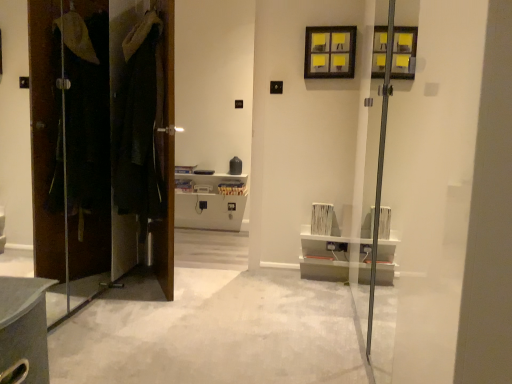
Question: Should I look upward or downward to see white carpet at center?

Choices:
 (A) down
 (B) up

Answer: (A)

Question: From a real-world perspective, is dark brown leather coat at left, which appears as the second door when viewed from the left, positioned over yellow paper at upper center based on gravity?

Choices:
 (A) yes
 (B) no

Answer: (B)

Question: Is there a large distance between dark brown leather coat at left, the first door in the right-to-left sequence, and yellow paper at upper center?

Choices:
 (A) yes
 (B) no

Answer: (A)

Question: Does dark brown leather coat at left, the first door in the right-to-left sequence, have a larger size compared to yellow paper at upper center?

Choices:
 (A) no
 (B) yes

Answer: (B)

Question: From the image's perspective, would you say dark brown leather coat at left, which appears as the second door when viewed from the left, is shown under yellow paper at upper center?

Choices:
 (A) no
 (B) yes

Answer: (B)

Question: Considering the relative sizes of dark brown leather coat at left, the first door in the right-to-left sequence, and yellow paper at upper center in the image provided, is dark brown leather coat at left, the first door in the right-to-left sequence, taller than yellow paper at upper center?

Choices:
 (A) yes
 (B) no

Answer: (A)

Question: Is dark brown leather coat at left, which appears as the second door when viewed from the left, wider than yellow paper at upper center?

Choices:
 (A) yes
 (B) no

Answer: (A)

Question: Is yellow paper at upper center closer to camera compared to white carpet at center?

Choices:
 (A) no
 (B) yes

Answer: (A)

Question: Is yellow paper at upper center taller than white carpet at center?

Choices:
 (A) no
 (B) yes

Answer: (B)

Question: From the image's perspective, is yellow paper at upper center below white carpet at center?

Choices:
 (A) yes
 (B) no

Answer: (B)

Question: Considering the relative sizes of yellow paper at upper center and white carpet at center in the image provided, is yellow paper at upper center smaller than white carpet at center?

Choices:
 (A) no
 (B) yes

Answer: (B)

Question: Considering the relative sizes of yellow paper at upper center and white carpet at center in the image provided, is yellow paper at upper center bigger than white carpet at center?

Choices:
 (A) yes
 (B) no

Answer: (B)

Question: Is yellow paper at upper center beside white carpet at center?

Choices:
 (A) no
 (B) yes

Answer: (A)

Question: Considering the relative sizes of brown wood door at left, the 2th door positioned from the right, and dark brown leather coat at left, the first door in the right-to-left sequence, in the image provided, is brown wood door at left, the 2th door positioned from the right, bigger than dark brown leather coat at left, the first door in the right-to-left sequence,?

Choices:
 (A) yes
 (B) no

Answer: (A)